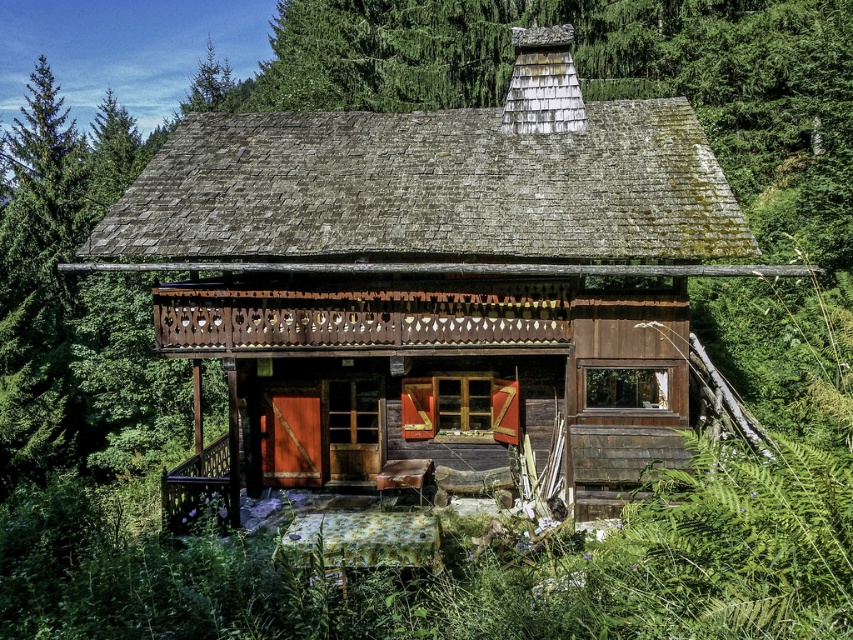
You are standing in front of the rustic wooden cabin and want to determine which of the two points, point (709,225) or point (614,432), is closer to you. Based on the scene description, which point is nearer?

Point (709,225) is closer to the viewer than point (614,432).

You are standing in front of the rustic wooden cabin at center and wooden porch at center. Which structure appears taller from your viewpoint?

The rustic wooden cabin at center is much taller than the wooden porch at center, so the cabin appears taller.

You are a visitor approaching the rustic wooden cabin at center and the wooden porch at center. Which structure do you think occupies more space in the scene?

The rustic wooden cabin at center is larger in size than the wooden porch at center, so it occupies more space in the scene.